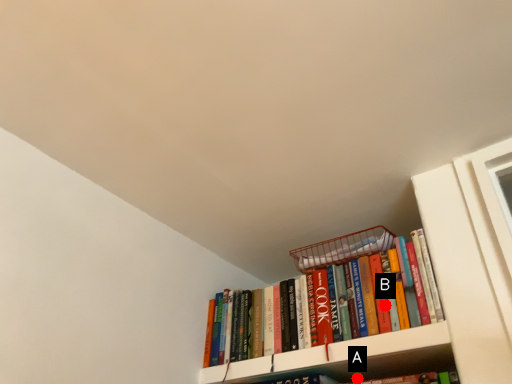
Question: Two points are circled on the image, labeled by A and B beside each circle. Among these points, which one is nearest to the camera?

Choices:
 (A) A is closer
 (B) B is closer

Answer: (B)